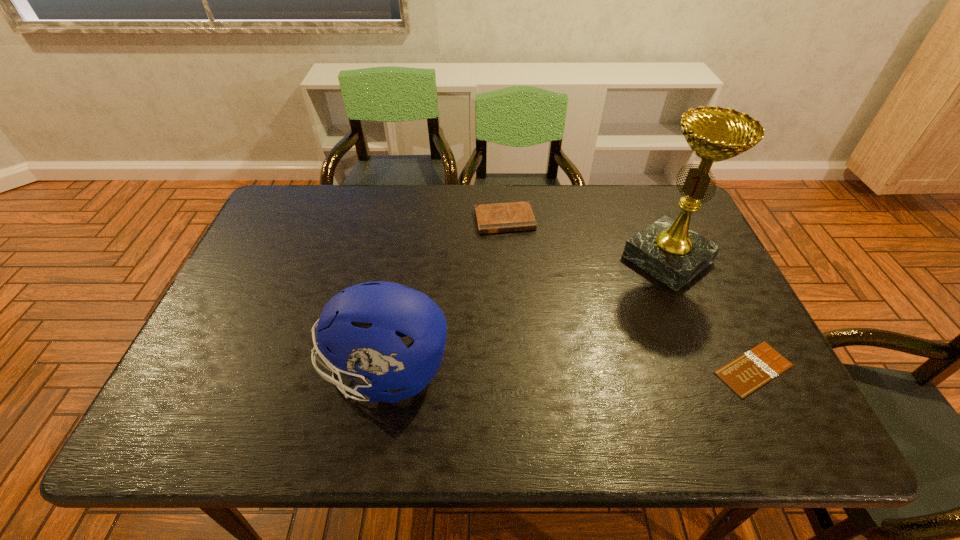
Find the location of `free space on the desktop that is between the football helmet and the shortest object and is positioned on the front-facing side of the tallest object`. free space on the desktop that is between the football helmet and the shortest object and is positioned on the front-facing side of the tallest object is located at coordinates (516, 370).

This screenshot has width=960, height=540. I want to click on free spot on the desktop that is between the leftmost object and the shortest object and is positioned on the spine side of the third object from right to left, so click(x=542, y=370).